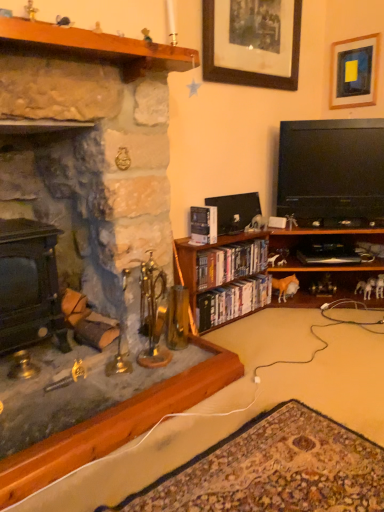
Image resolution: width=384 pixels, height=512 pixels. What are the coordinates of `free space in front of wooden bookshelf at lower center` in the screenshot? It's located at (285, 420).